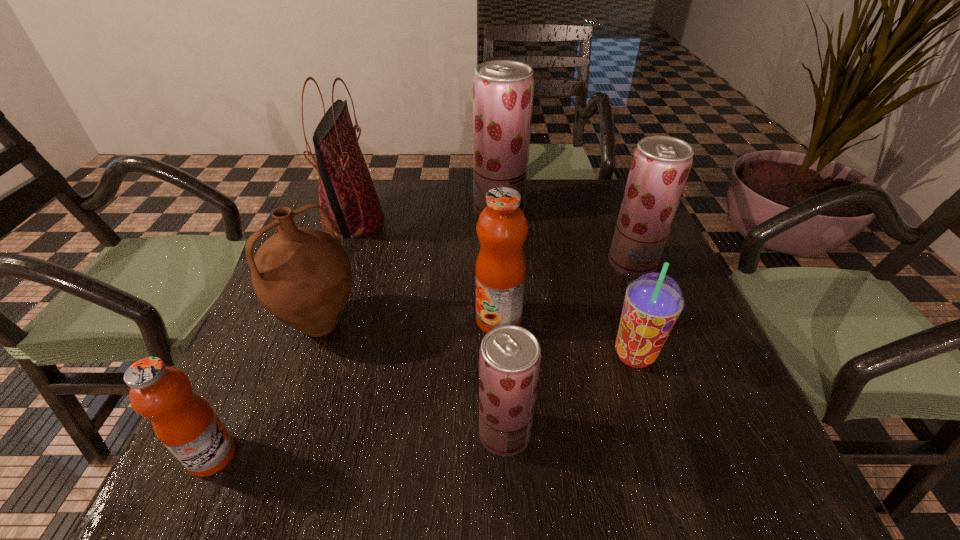
The width and height of the screenshot is (960, 540). Find the location of `object present at the near left corner`. object present at the near left corner is located at coordinates (184, 422).

Identify the location of blank area at the far edge. (385, 182).

Identify the location of vacant space at the near edge of the desktop. (296, 469).

Image resolution: width=960 pixels, height=540 pixels. I want to click on vacant space at the near left corner of the desktop, so click(234, 490).

In the image, there is a desktop. Where is `free space at the far right corner`? The image size is (960, 540). free space at the far right corner is located at coordinates (614, 212).

Find the location of a particular element. This screenshot has height=540, width=960. free spot between the smallest strawberry fruit juice and the brown pitcher is located at coordinates (413, 379).

The width and height of the screenshot is (960, 540). In order to click on free space between the right orange fruit juice and the smaller orange fruit juice in this screenshot , I will do `click(355, 388)`.

Where is `vacant region between the smallest strawberry fruit juice and the smoothie`? The image size is (960, 540). vacant region between the smallest strawberry fruit juice and the smoothie is located at coordinates (569, 394).

Find the location of a particular element. The height and width of the screenshot is (540, 960). vacant area that lies between the smoothie and the right orange fruit juice is located at coordinates (566, 338).

Locate an element on the screen. The width and height of the screenshot is (960, 540). free space between the smoothie and the farthest strawberry fruit juice is located at coordinates (566, 282).